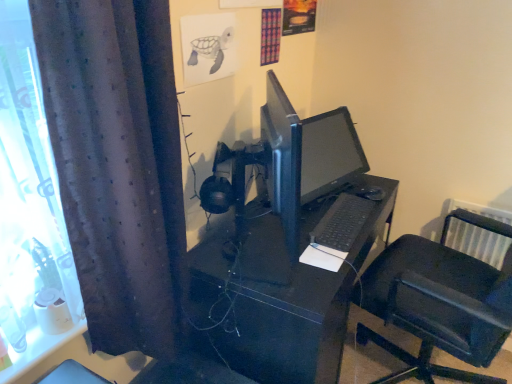
Question: From a real-world perspective, is black glossy monitor at center physically below black matte keyboard at center?

Choices:
 (A) no
 (B) yes

Answer: (A)

Question: From a real-world perspective, is black glossy monitor at center located higher than black matte keyboard at center?

Choices:
 (A) no
 (B) yes

Answer: (B)

Question: Considering the relative sizes of black glossy monitor at center and black matte keyboard at center in the image provided, is black glossy monitor at center smaller than black matte keyboard at center?

Choices:
 (A) yes
 (B) no

Answer: (B)

Question: Is black matte keyboard at center a part of black glossy monitor at center?

Choices:
 (A) no
 (B) yes

Answer: (A)

Question: Considering the relative sizes of black glossy monitor at center and black matte keyboard at center in the image provided, is black glossy monitor at center taller than black matte keyboard at center?

Choices:
 (A) no
 (B) yes

Answer: (B)

Question: Based on their sizes in the image, would you say dark purple fabric curtain at left is bigger or smaller than black matte desk at center?

Choices:
 (A) small
 (B) big

Answer: (A)

Question: Would you say dark purple fabric curtain at left is to the left or to the right of black matte desk at center in the picture?

Choices:
 (A) right
 (B) left

Answer: (B)

Question: From the image's perspective, relative to black matte desk at center, is dark purple fabric curtain at left above or below?

Choices:
 (A) below
 (B) above

Answer: (B)

Question: Is dark purple fabric curtain at left in front of or behind black matte desk at center in the image?

Choices:
 (A) front
 (B) behind

Answer: (A)

Question: From the image's perspective, is black plastic chair at right located above or below black matte keyboard at center?

Choices:
 (A) above
 (B) below

Answer: (B)

Question: Looking at their shapes, would you say black plastic chair at right is wider or thinner than black matte keyboard at center?

Choices:
 (A) thin
 (B) wide

Answer: (B)

Question: Looking at the image, does black plastic chair at right seem bigger or smaller compared to black matte keyboard at center?

Choices:
 (A) small
 (B) big

Answer: (B)

Question: Is point (458, 261) positioned closer to the camera than point (310, 243)?

Choices:
 (A) closer
 (B) farther

Answer: (B)

Question: In the image, is black matte desk at center positioned in front of or behind black glossy monitor at center?

Choices:
 (A) behind
 (B) front

Answer: (B)

Question: Based on their positions, is black matte desk at center located to the left or right of black glossy monitor at center?

Choices:
 (A) left
 (B) right

Answer: (A)